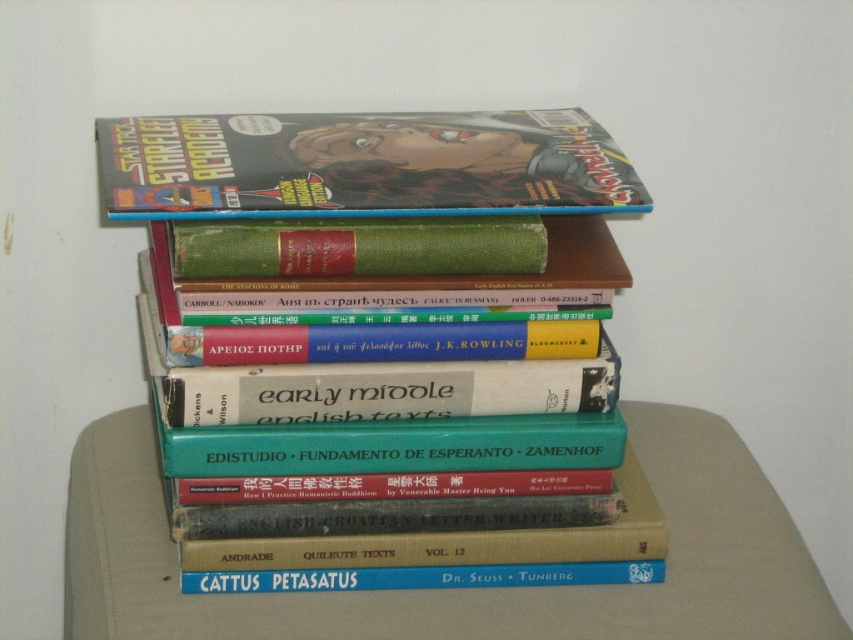
Question: Which object is positioned farthest from the matte comic book at center?

Choices:
 (A) smooth beige table at center
 (B) hardcover book at center

Answer: (A)

Question: Which point appears farthest from the camera in this image?

Choices:
 (A) (146, 577)
 (B) (346, 189)
 (C) (309, 515)

Answer: (A)

Question: From the image, what is the correct spatial relationship of hardcover book at center in relation to matte comic book at center?

Choices:
 (A) below
 (B) above

Answer: (A)

Question: Does smooth beige table at center appear on the left side of matte comic book at center?

Choices:
 (A) no
 (B) yes

Answer: (A)

Question: Estimate the real-world distances between objects in this image. Which object is farther from the hardcover book at center?

Choices:
 (A) matte comic book at center
 (B) smooth beige table at center

Answer: (A)

Question: Does hardcover book at center have a lesser width compared to smooth beige table at center?

Choices:
 (A) yes
 (B) no

Answer: (A)